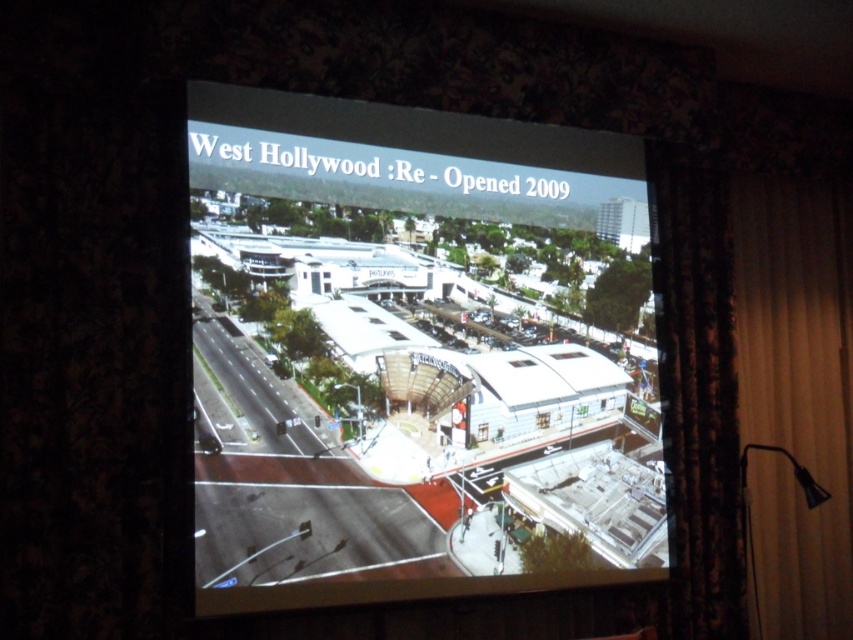
Question: In this image, where is beige fabric curtain at right located relative to black floral curtain at right?

Choices:
 (A) left
 (B) right

Answer: (B)

Question: Among these objects, which one is nearest to the camera?

Choices:
 (A) black floral curtain at right
 (B) white glossy building at center
 (C) beige fabric curtain at right

Answer: (B)

Question: Which of the following is the closest to the observer?

Choices:
 (A) beige fabric curtain at right
 (B) white glossy building at center
 (C) black floral curtain at right

Answer: (B)

Question: Based on their relative distances, which object is farther from the white glossy building at center?

Choices:
 (A) beige fabric curtain at right
 (B) black floral curtain at right

Answer: (A)

Question: Can you confirm if beige fabric curtain at right is positioned below black floral curtain at right?

Choices:
 (A) no
 (B) yes

Answer: (B)

Question: Can you confirm if beige fabric curtain at right is positioned below black floral curtain at right?

Choices:
 (A) no
 (B) yes

Answer: (B)